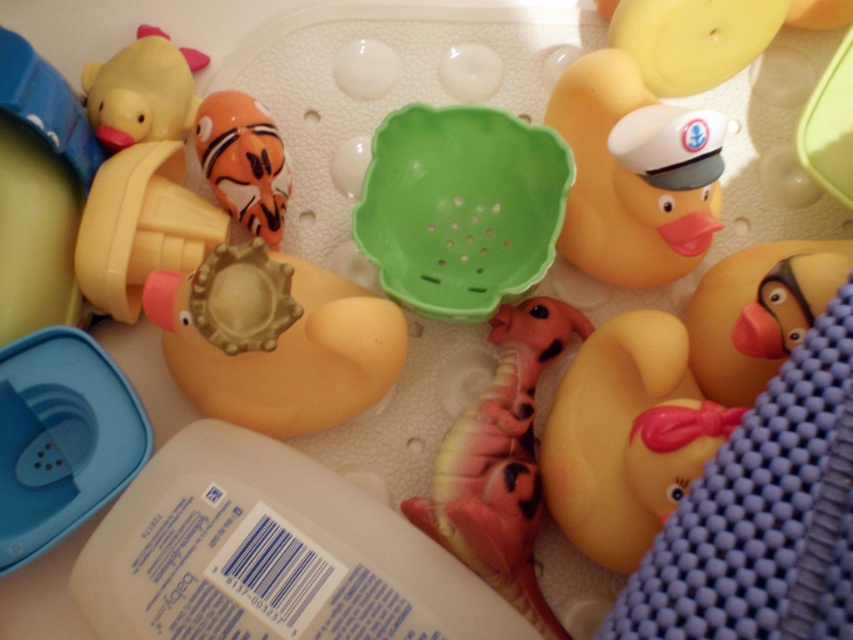
Is yellow rubber duck at center to the right of translucent orange fish at center from the viewer's perspective?

Yes, yellow rubber duck at center is to the right of translucent orange fish at center.

Image resolution: width=853 pixels, height=640 pixels. Identify the location of yellow rubber duck at center. (625, 436).

Does tan rubber duck at center have a lesser height compared to translucent orange fish at center?

No, tan rubber duck at center is not shorter than translucent orange fish at center.

Is tan rubber duck at center to the right of translucent orange fish at center from the viewer's perspective?

Indeed, tan rubber duck at center is positioned on the right side of translucent orange fish at center.

Is point (215, 305) positioned before point (195, 131)?

Yes, point (215, 305) is closer to viewer.

Where is `tan rubber duck at center`? This screenshot has width=853, height=640. tan rubber duck at center is located at coordinates (274, 339).

Does tan rubber duck at center have a greater height compared to yellow rubber duck at center?

No.

Which is below, tan rubber duck at center or yellow rubber duck at center?

Positioned lower is yellow rubber duck at center.

Is point (315, 422) farther from viewer compared to point (547, 460)?

Yes.

I want to click on tan rubber duck at center, so click(274, 339).